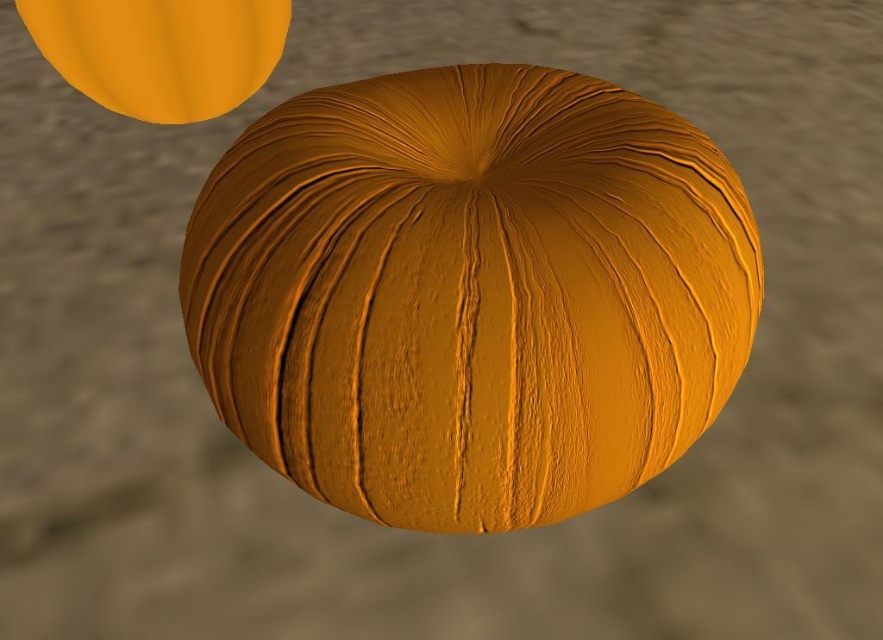
Does point (378, 131) come closer to viewer compared to point (250, 67)?

That is True.

This screenshot has height=640, width=883. I want to click on matte orange sphere at center, so click(x=469, y=292).